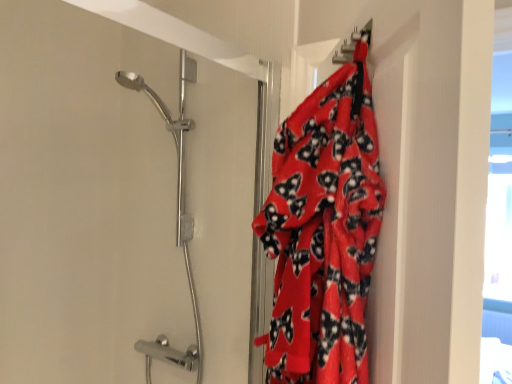
Question: From the image's perspective, is fluffy red blanket at right beneath polished chrome shower head at upper left?

Choices:
 (A) yes
 (B) no

Answer: (B)

Question: Is fluffy red blanket at right behind polished chrome shower head at upper left?

Choices:
 (A) yes
 (B) no

Answer: (B)

Question: Is fluffy red blanket at right located outside polished chrome shower head at upper left?

Choices:
 (A) no
 (B) yes

Answer: (B)

Question: Considering the relative sizes of fluffy red blanket at right and polished chrome shower head at upper left in the image provided, is fluffy red blanket at right smaller than polished chrome shower head at upper left?

Choices:
 (A) yes
 (B) no

Answer: (A)

Question: Is fluffy red blanket at right looking in the opposite direction of polished chrome shower head at upper left?

Choices:
 (A) yes
 (B) no

Answer: (B)

Question: Is polished chrome shower head at upper left completely or partially inside fluffy red blanket at right?

Choices:
 (A) yes
 (B) no

Answer: (B)

Question: Is polished chrome shower head at upper left facing towards fluffy red blanket at right?

Choices:
 (A) no
 (B) yes

Answer: (A)

Question: Does polished chrome shower head at upper left have a lesser width compared to fluffy red blanket at right?

Choices:
 (A) no
 (B) yes

Answer: (A)

Question: Could fluffy red blanket at right be considered to be inside polished chrome shower head at upper left?

Choices:
 (A) no
 (B) yes

Answer: (A)

Question: Does polished chrome shower head at upper left have a lesser height compared to fluffy red blanket at right?

Choices:
 (A) no
 (B) yes

Answer: (A)

Question: Are polished chrome shower head at upper left and fluffy red blanket at right beside each other?

Choices:
 (A) no
 (B) yes

Answer: (A)

Question: Would you consider polished chrome shower head at upper left to be distant from fluffy red blanket at right?

Choices:
 (A) yes
 (B) no

Answer: (B)

Question: Is fluffy red blanket at right in front of or behind polished chrome shower head at upper left in the image?

Choices:
 (A) front
 (B) behind

Answer: (A)